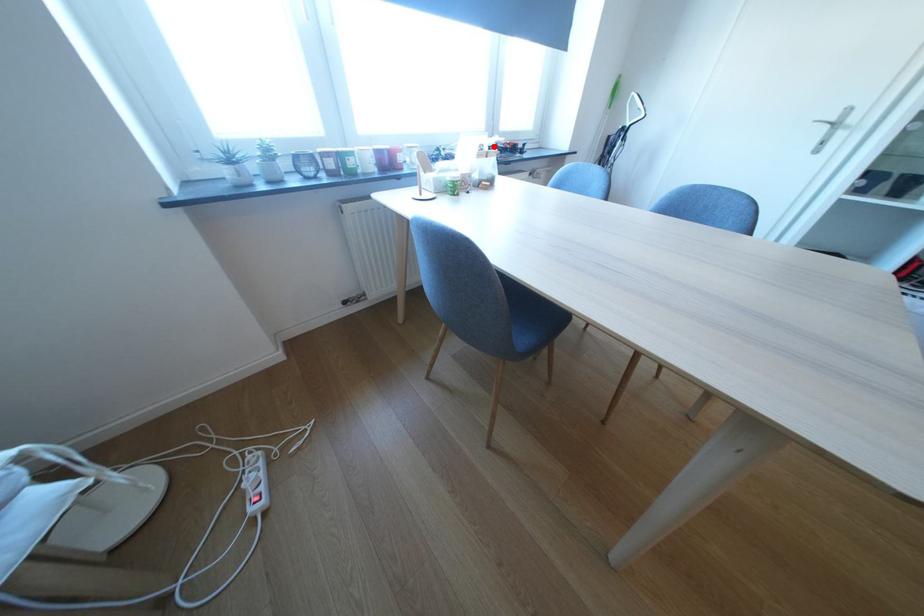
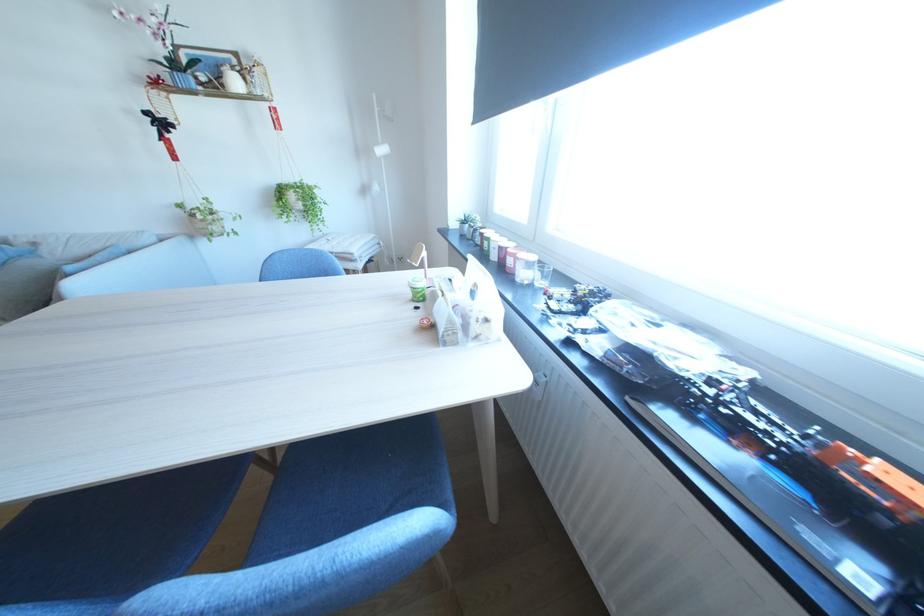
The point at the highlighted location is marked in the first image. Where is the corresponding point in the second image?

(489, 288)